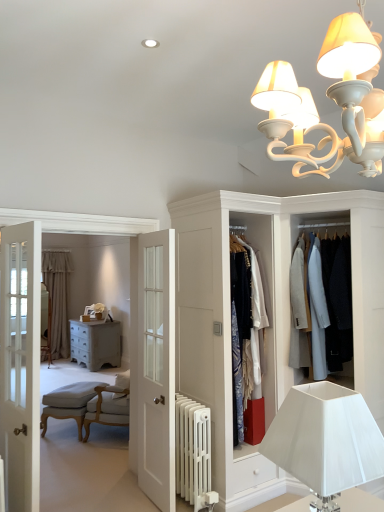
Question: Can you confirm if white matte chandelier at upper center, the 1th lamp viewed from the top, is wider than white painted radiator at lower center?

Choices:
 (A) no
 (B) yes

Answer: (A)

Question: Is white matte chandelier at upper center, which appears as the 2th lamp when ordered from the bottom, looking in the opposite direction of white painted radiator at lower center?

Choices:
 (A) no
 (B) yes

Answer: (A)

Question: Is white matte chandelier at upper center, which appears as the 2th lamp when ordered from the bottom, positioned far away from white painted radiator at lower center?

Choices:
 (A) no
 (B) yes

Answer: (B)

Question: Is the depth of white matte chandelier at upper center, which appears as the 2th lamp when ordered from the bottom, greater than that of white painted radiator at lower center?

Choices:
 (A) yes
 (B) no

Answer: (B)

Question: Does white matte chandelier at upper center, the 1th lamp viewed from the top, appear on the left side of white painted radiator at lower center?

Choices:
 (A) yes
 (B) no

Answer: (B)

Question: Is light beige fabric armchair at lower left inside the boundaries of distressed gray chest of drawers at center, or outside?

Choices:
 (A) outside
 (B) inside

Answer: (A)

Question: In terms of size, does light beige fabric armchair at lower left appear bigger or smaller than distressed gray chest of drawers at center?

Choices:
 (A) small
 (B) big

Answer: (A)

Question: Considering the positions of point (69, 394) and point (91, 324), is point (69, 394) closer or farther from the camera than point (91, 324)?

Choices:
 (A) closer
 (B) farther

Answer: (A)

Question: Would you say light beige fabric armchair at lower left is to the left or to the right of distressed gray chest of drawers at center in the picture?

Choices:
 (A) left
 (B) right

Answer: (B)

Question: In the image, is white fabric lampshade at lower right, placed as the 1th lamp when sorted from bottom to top, on the left side or the right side of white matte chandelier at upper center, the 1th lamp viewed from the top?

Choices:
 (A) right
 (B) left

Answer: (B)

Question: Is point click(332, 502) positioned closer to the camera than point click(332, 46)?

Choices:
 (A) closer
 (B) farther

Answer: (B)

Question: From the image's perspective, is white fabric lampshade at lower right, the 2th lamp from the top, above or below white matte chandelier at upper center, which appears as the 2th lamp when ordered from the bottom?

Choices:
 (A) above
 (B) below

Answer: (B)

Question: Is white fabric lampshade at lower right, placed as the 1th lamp when sorted from bottom to top, in front of or behind white matte chandelier at upper center, which appears as the 2th lamp when ordered from the bottom, in the image?

Choices:
 (A) behind
 (B) front

Answer: (A)

Question: Considering the positions of light gray wool coat at center, marked as the second clothing in a left-to-right arrangement, and white matte chandelier at upper center, the 1th lamp viewed from the top, in the image, is light gray wool coat at center, marked as the second clothing in a left-to-right arrangement, bigger or smaller than white matte chandelier at upper center, the 1th lamp viewed from the top,?

Choices:
 (A) small
 (B) big

Answer: (B)

Question: Does point (314, 374) appear closer or farther from the camera than point (382, 117)?

Choices:
 (A) farther
 (B) closer

Answer: (A)